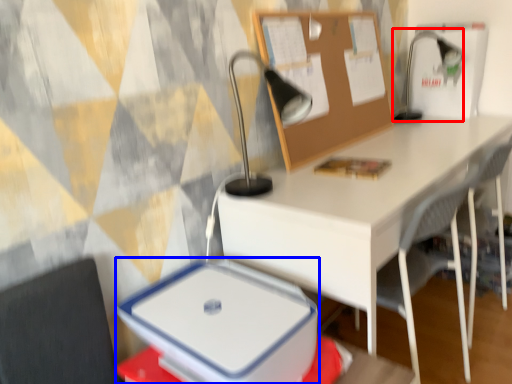
Question: Which point is closer to the camera, table lamp (highlighted by a red box) or lunch box (highlighted by a blue box)?

Choices:
 (A) table lamp
 (B) lunch box

Answer: (B)